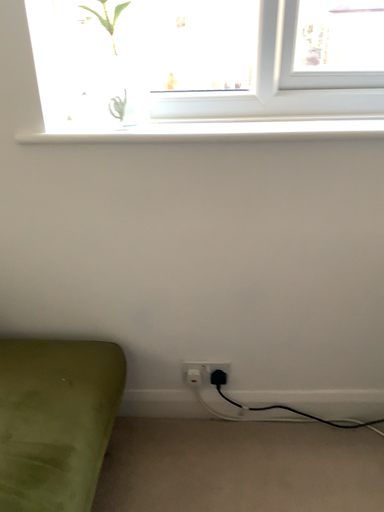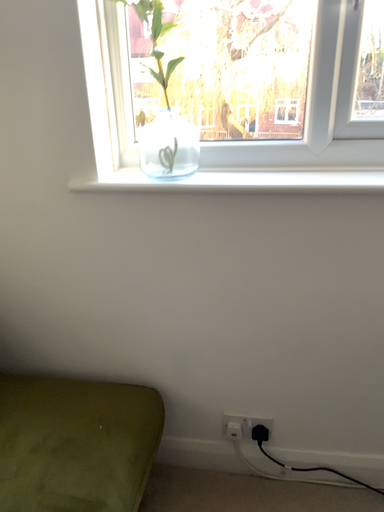
Question: Which way did the camera rotate in the video?

Choices:
 (A) rotated right
 (B) rotated left

Answer: (B)